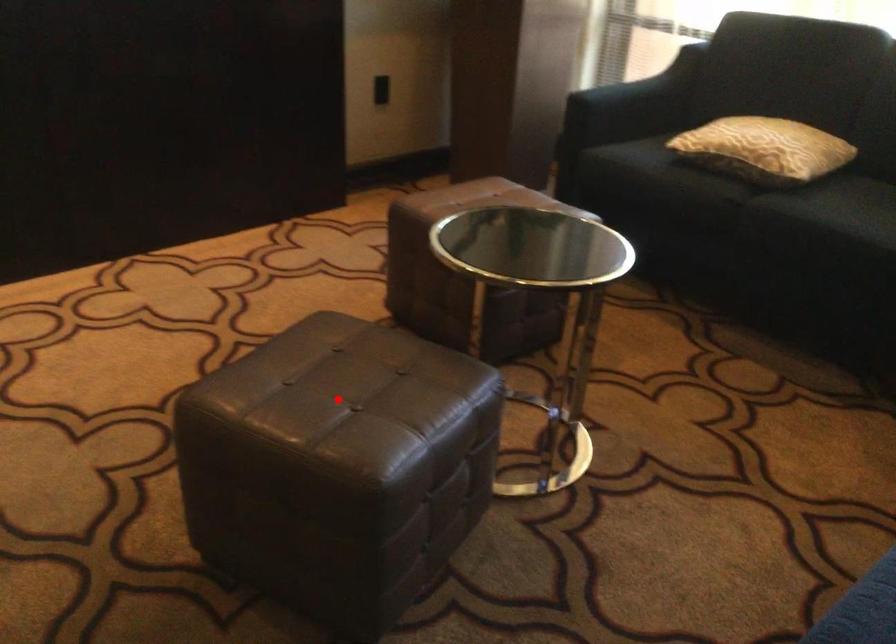
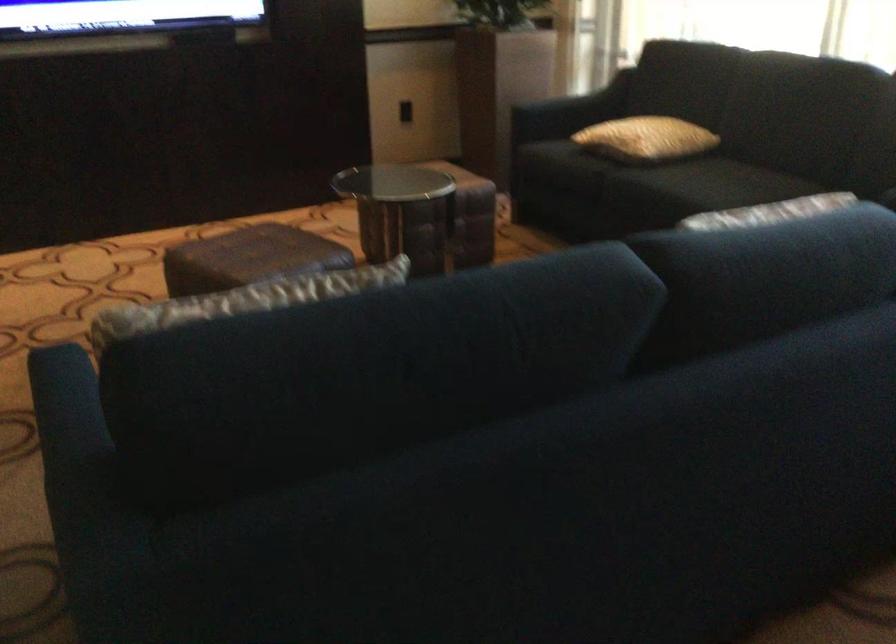
Question: A red point is marked in image1. In image2, is the corresponding 3D point closer to the camera or farther? Reply with the corresponding letter.

Choices:
 (A) The corresponding 3D point is closer.
 (B) The corresponding 3D point is farther.

Answer: (B)